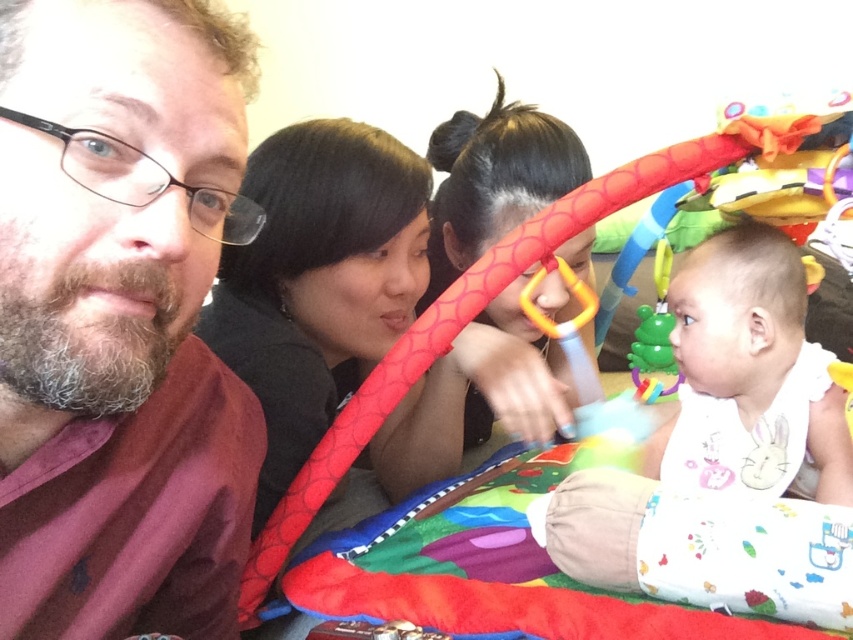
Is point (13, 172) closer to viewer compared to point (822, 570)?

Yes, point (13, 172) is closer to viewer.

Who is shorter, matte red shirt at left or white cotton bib at center?

white cotton bib at center is shorter.

Who is more distant from viewer, (109, 433) or (663, 528)?

Positioned behind is point (663, 528).

This screenshot has height=640, width=853. Identify the location of matte red shirt at left. (120, 320).

Who is taller, white cotton bib at center or white soft bib at lower right?

white cotton bib at center

Is white cotton bib at center shorter than white soft bib at lower right?

No.

Describe the element at coordinates (726, 456) in the screenshot. I see `white cotton bib at center` at that location.

Locate an element on the screen. white cotton bib at center is located at coordinates (726, 456).

Does matte red shirt at left appear on the left side of white soft bib at lower right?

Indeed, matte red shirt at left is positioned on the left side of white soft bib at lower right.

Can you confirm if matte red shirt at left is thinner than white soft bib at lower right?

Correct, matte red shirt at left's width is less than white soft bib at lower right's.

What do you see at coordinates (120, 320) in the screenshot?
I see `matte red shirt at left` at bounding box center [120, 320].

Find the location of a particular element. matte red shirt at left is located at coordinates point(120,320).